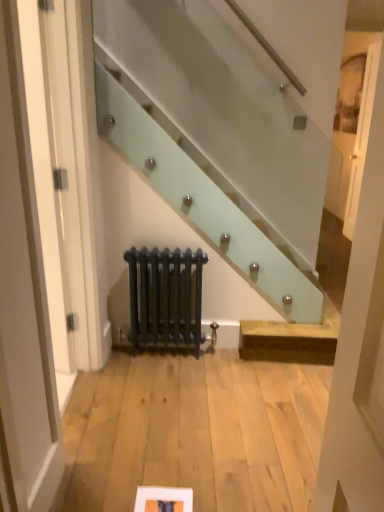
Question: Is matte black radiator at center positioned beyond the bounds of white glossy door at upper right?

Choices:
 (A) yes
 (B) no

Answer: (A)

Question: Is white glossy door at upper right a part of matte black radiator at center?

Choices:
 (A) no
 (B) yes

Answer: (A)

Question: Is matte black radiator at center far away from white glossy door at upper right?

Choices:
 (A) yes
 (B) no

Answer: (A)

Question: Does matte black radiator at center have a lesser height compared to white glossy door at upper right?

Choices:
 (A) no
 (B) yes

Answer: (B)

Question: From the image's perspective, is matte black radiator at center under white glossy door at upper right?

Choices:
 (A) no
 (B) yes

Answer: (B)

Question: From the image's perspective, is matte black radiator at center positioned above or below white glossy door at upper right?

Choices:
 (A) above
 (B) below

Answer: (B)

Question: From a real-world perspective, is matte black radiator at center positioned above or below white glossy door at upper right?

Choices:
 (A) above
 (B) below

Answer: (B)

Question: Is matte black radiator at center taller or shorter than white glossy door at upper right?

Choices:
 (A) short
 (B) tall

Answer: (A)

Question: In terms of size, does matte black radiator at center appear bigger or smaller than white glossy door at upper right?

Choices:
 (A) small
 (B) big

Answer: (B)

Question: Considering their positions, is matte white picture frame at lower center located in front of or behind white glossy door at upper right?

Choices:
 (A) front
 (B) behind

Answer: (A)

Question: Is point click(190, 489) closer or farther from the camera than point click(379, 44)?

Choices:
 (A) closer
 (B) farther

Answer: (A)

Question: From a real-world perspective, is matte white picture frame at lower center above or below white glossy door at upper right?

Choices:
 (A) below
 (B) above

Answer: (A)

Question: From the image's perspective, is matte white picture frame at lower center positioned above or below white glossy door at upper right?

Choices:
 (A) below
 (B) above

Answer: (A)

Question: From a real-world perspective, relative to matte white picture frame at lower center, is matte black radiator at center vertically above or below?

Choices:
 (A) above
 (B) below

Answer: (A)

Question: Looking at the image, does matte black radiator at center seem bigger or smaller compared to matte white picture frame at lower center?

Choices:
 (A) small
 (B) big

Answer: (B)